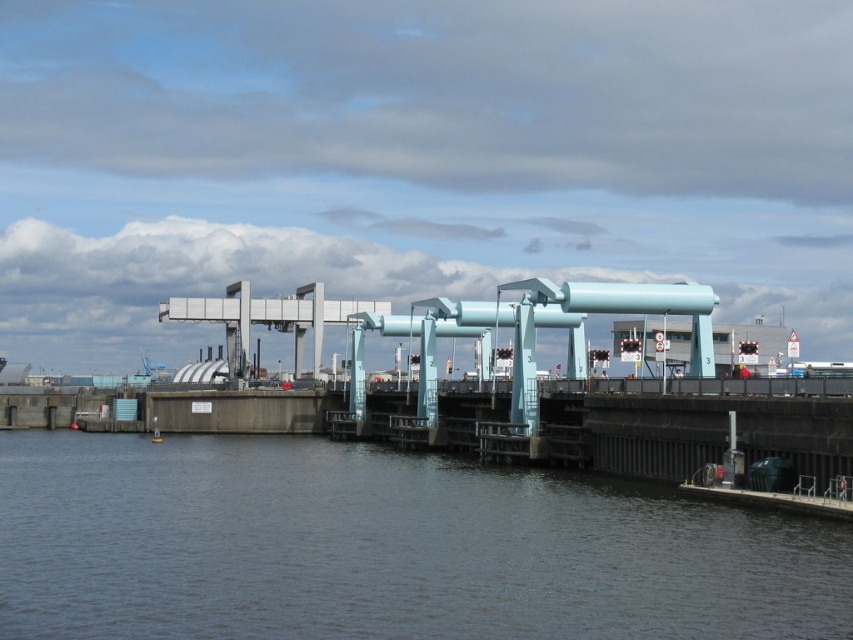
You are a drone operator tasked with capturing aerial footage of the industrial structure. Your drone is currently at a position above the dark gray water at lower center. To ensure safety, you need to move the drone to a higher elevation. In which direction should you adjust the drone to ascend vertically?

The dark gray water at lower center is located at point coordinates, so you should ascend vertically upwards away from the water to ensure safety.

You are a boat operator who needs to navigate your metallic silver boat at center through a narrow channel. The channel is only as wide as the dark gray water at lower center. Will your boat fit through the channel?

The dark gray water at lower center is wider than the metallic silver boat at center. Since the channel is as wide as the dark gray water at lower center, the metallic silver boat at center will fit through the channel.